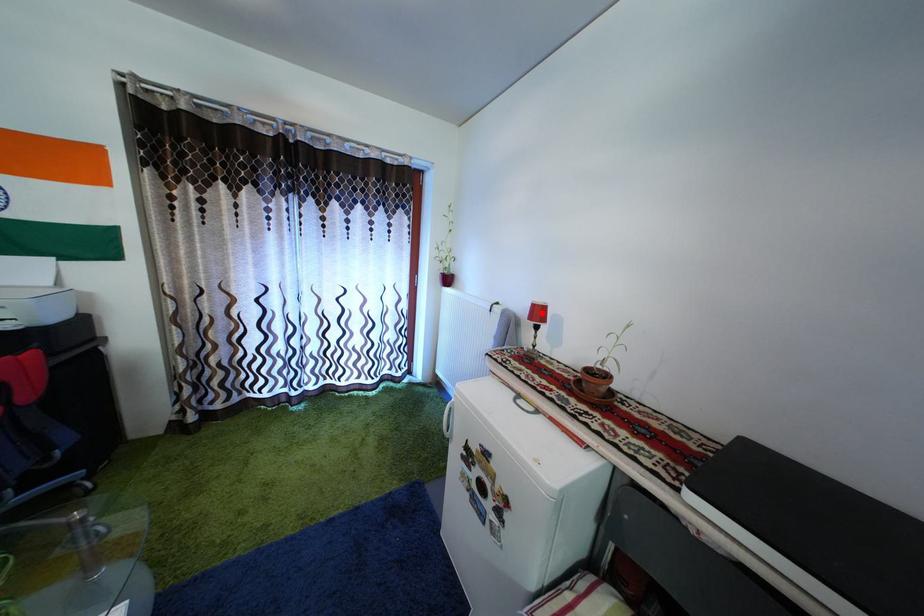
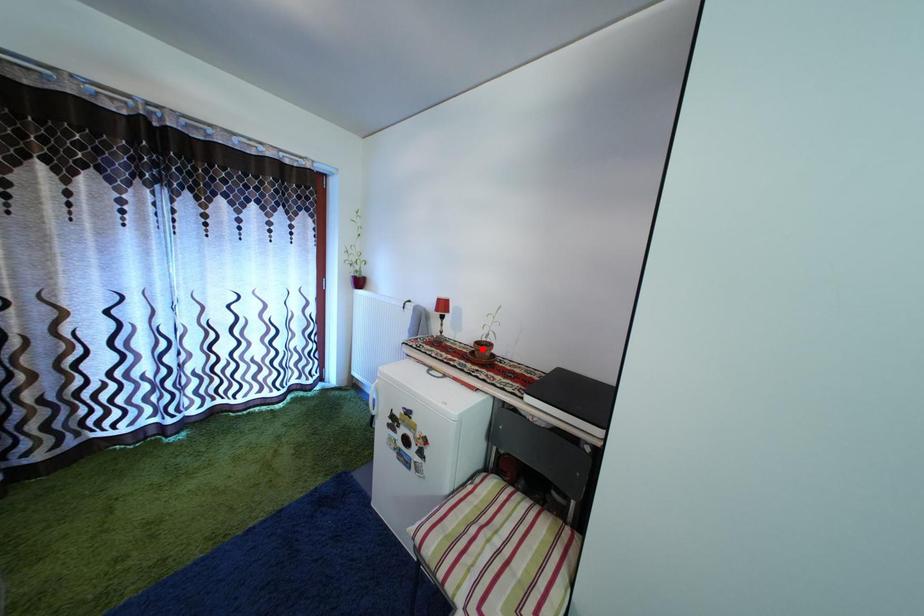
I am providing you with two images of the same scene from different viewpoints. A red point is marked on the first image and another point is marked on the second image. Does the point marked in image1 correspond to the same location as the one in image2?

No